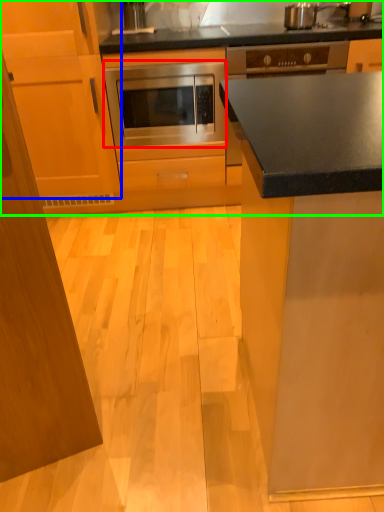
Question: Which object is positioned closest to oven (highlighted by a red box)? Select from cabinetry (highlighted by a blue box) and cabinetry (highlighted by a green box).

Choices:
 (A) cabinetry
 (B) cabinetry

Answer: (B)